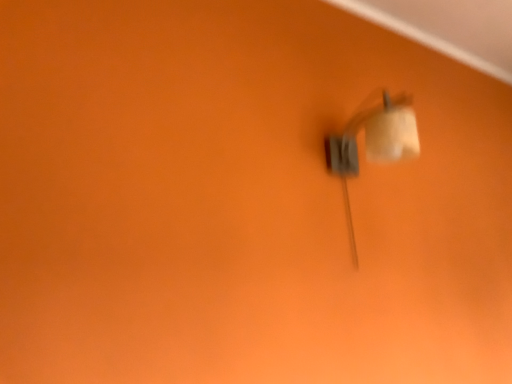
Locate an element on the screen. white matte lamp at upper right is located at coordinates (372, 143).

This screenshot has height=384, width=512. What do you see at coordinates (372, 143) in the screenshot?
I see `white matte lamp at upper right` at bounding box center [372, 143].

Locate an element on the screen. white matte lamp at upper right is located at coordinates (372, 143).